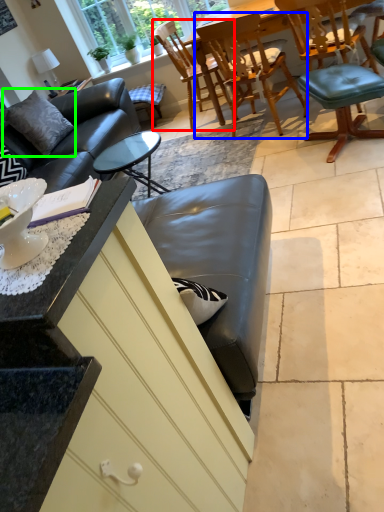
Question: Which object is the farthest from chair (highlighted by a red box)? Choose among these: chair (highlighted by a blue box) or pillow (highlighted by a green box).

Choices:
 (A) chair
 (B) pillow

Answer: (B)